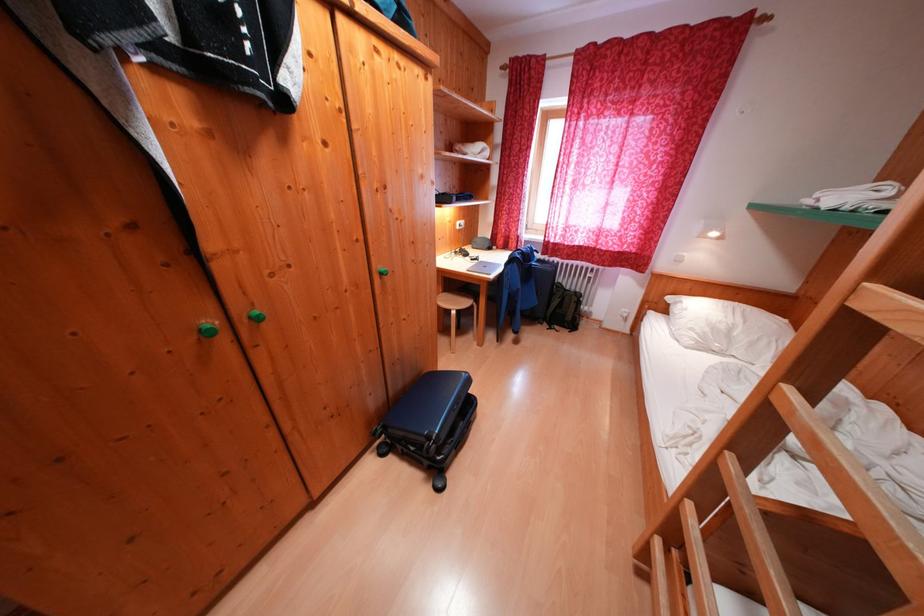
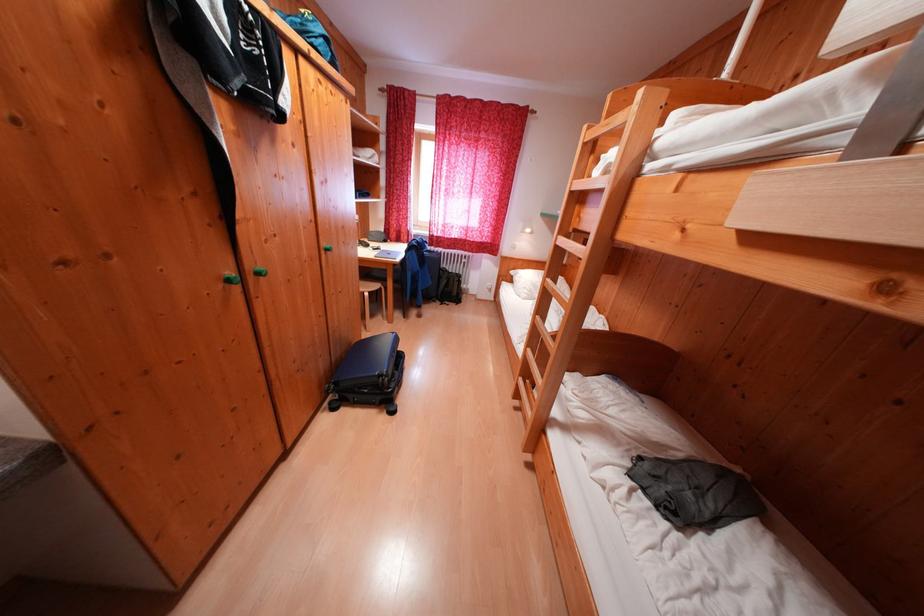
Find the pixel in the second image that matches point 219,326 in the first image.

(238, 278)